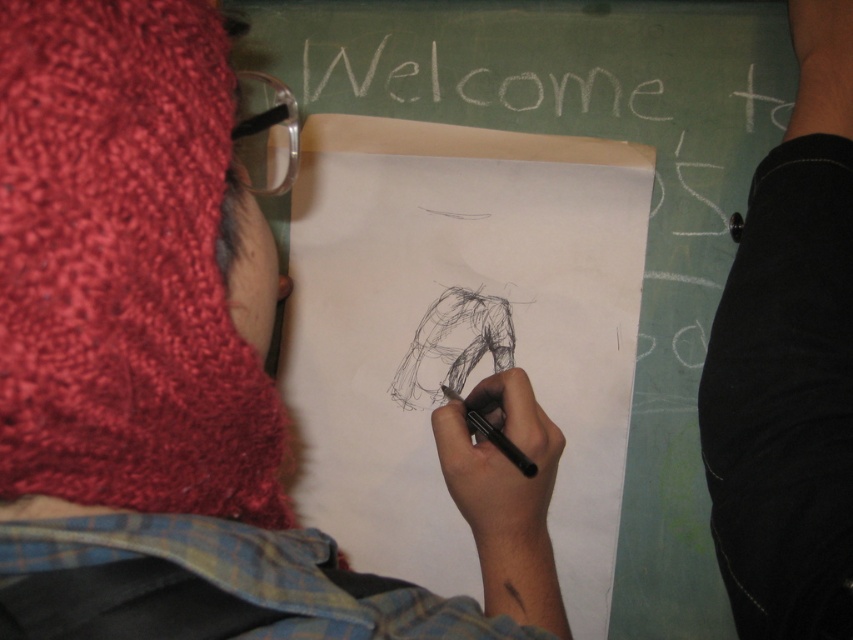
Locate an element on the screen. Image resolution: width=853 pixels, height=640 pixels. black fabric pants at lower right is located at coordinates (788, 364).

Who is taller, black fabric pants at lower right or black smooth pen at center?

With more height is black fabric pants at lower right.

You are a GUI agent. You are given a task and a screenshot of the screen. Output one action in this format:
    pyautogui.click(x=<x>, y=<y>)
    Task: Click on the black fabric pants at lower right
    The image size is (853, 640).
    Given the screenshot: What is the action you would take?
    pyautogui.click(x=788, y=364)

What do you see at coordinates (189, 339) in the screenshot? I see `knitted wool hat at upper left` at bounding box center [189, 339].

Is point (96, 113) positioned in front of point (809, 248)?

That is True.

At what (x,y) coordinates should I click in order to perform the action: click on knitted wool hat at upper left. Please return your answer as a coordinate pair (x, y). Looking at the image, I should click on (189, 339).

Who is more distant from viewer, (74, 13) or (511, 442)?

The point (511, 442) is behind.

Does point (120, 481) come closer to viewer compared to point (485, 419)?

Yes, it is in front of point (485, 419).

Locate an element on the screen. Image resolution: width=853 pixels, height=640 pixels. knitted wool hat at upper left is located at coordinates pyautogui.click(x=189, y=339).